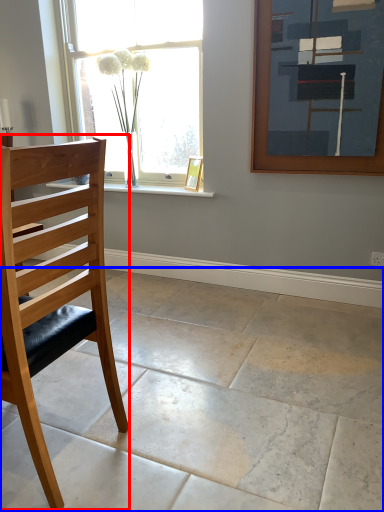
Question: Which point is closer to the camera, chair (highlighted by a red box) or concrete (highlighted by a blue box)?

Choices:
 (A) chair
 (B) concrete

Answer: (B)